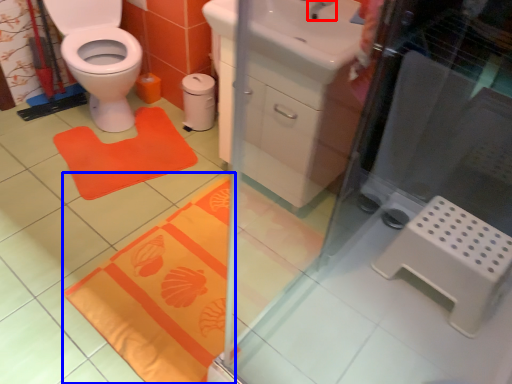
Question: Which object appears farthest to the camera in this image, tap (highlighted by a red box) or bath mat (highlighted by a blue box)?

Choices:
 (A) tap
 (B) bath mat

Answer: (A)